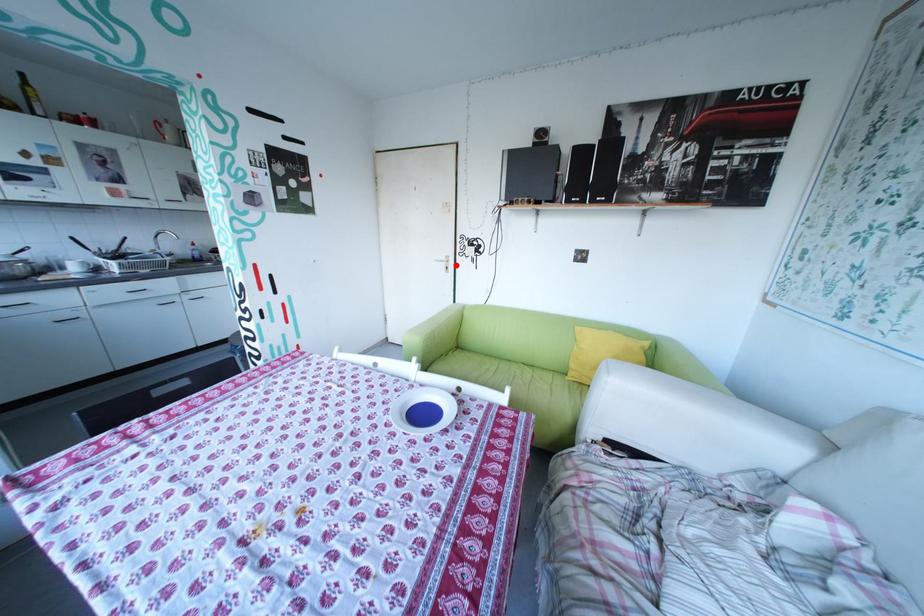
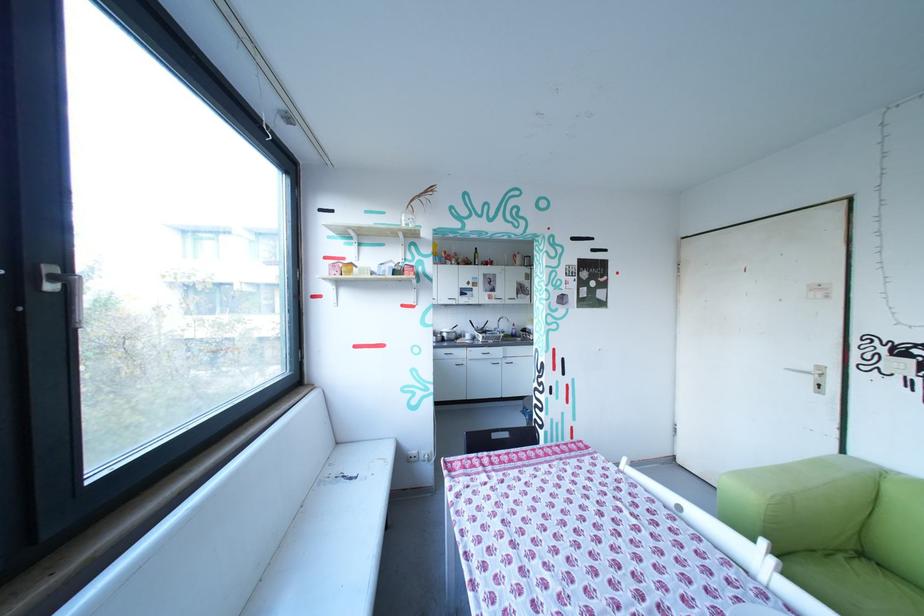
Find the pixel in the second image that matches the highlighted location in the first image.

(821, 379)